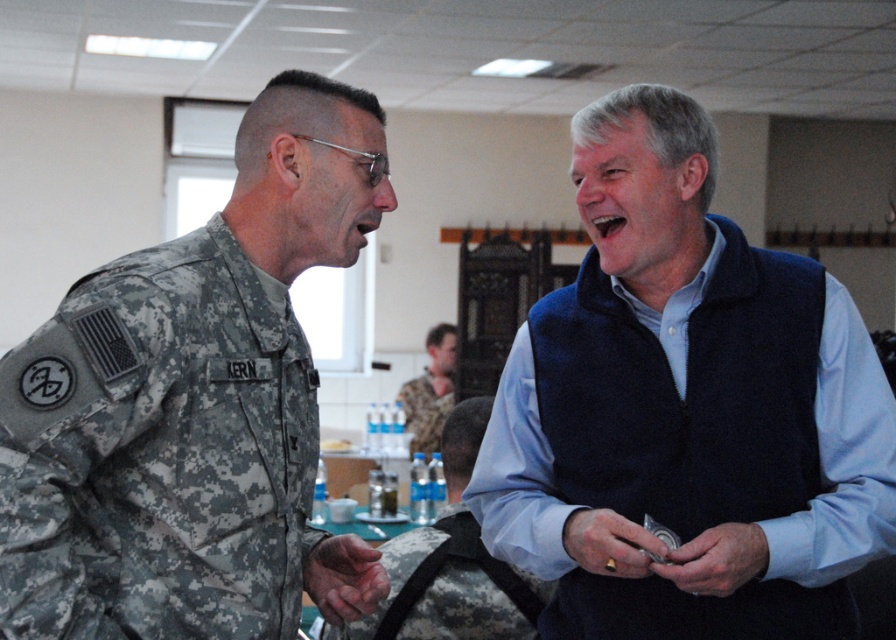
Question: Which of the following is the closest to the observer?

Choices:
 (A) blue fleece vest at center
 (B) metallic ring at lower center
 (C) camouflage uniform at center
 (D) dry skin at center

Answer: (B)

Question: Is metallic silver watch at lower center smaller than camouflage uniform at center?

Choices:
 (A) no
 (B) yes

Answer: (B)

Question: Which object appears farthest from the camera in this image?

Choices:
 (A) camouflage uniform at left
 (B) metallic silver watch at lower center

Answer: (B)

Question: Does metallic silver watch at lower center come behind metallic ring at lower center?

Choices:
 (A) no
 (B) yes

Answer: (A)

Question: Which point appears closest to the camera in this image?

Choices:
 (A) (308, 557)
 (B) (685, 518)

Answer: (B)

Question: Can you confirm if camouflage fabric bag at center is thinner than metallic ring at lower center?

Choices:
 (A) no
 (B) yes

Answer: (A)